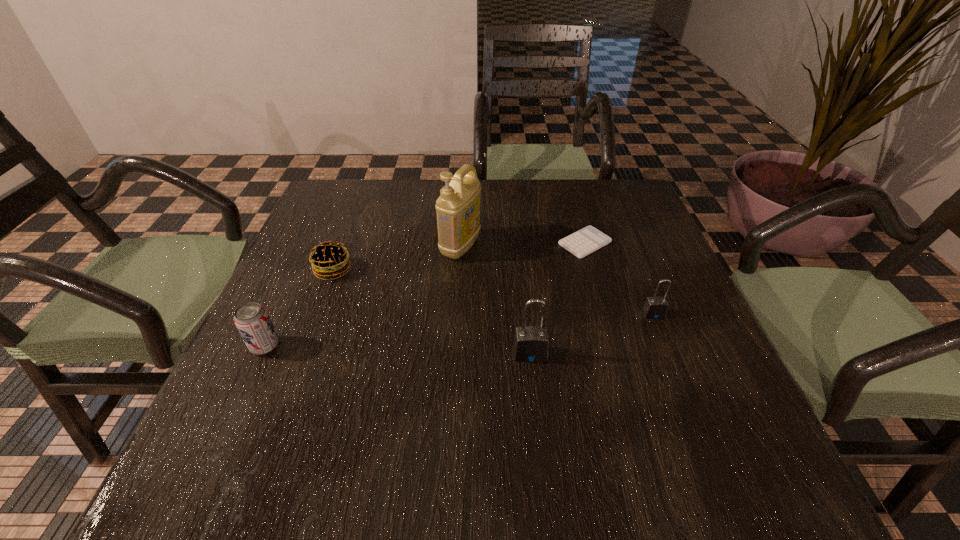
Identify the location of the second tallest object. (531, 344).

This screenshot has height=540, width=960. Find the location of `the third object from right to left`. the third object from right to left is located at coordinates (531, 344).

The height and width of the screenshot is (540, 960). Identify the location of the farther padlock. (655, 307).

I want to click on the right padlock, so click(x=655, y=307).

At what (x,y) coordinates should I click in order to perform the action: click on patty. Please return your answer as a coordinate pair (x, y). This screenshot has width=960, height=540. Looking at the image, I should click on (329, 259).

The height and width of the screenshot is (540, 960). I want to click on the second object from left to right, so click(x=329, y=259).

Where is `detergent`? detergent is located at coordinates (458, 207).

Where is `the third object from left to right`? the third object from left to right is located at coordinates (458, 207).

I want to click on the leftmost object, so click(x=251, y=319).

Locate an element on the screen. the fifth object from left to right is located at coordinates (587, 240).